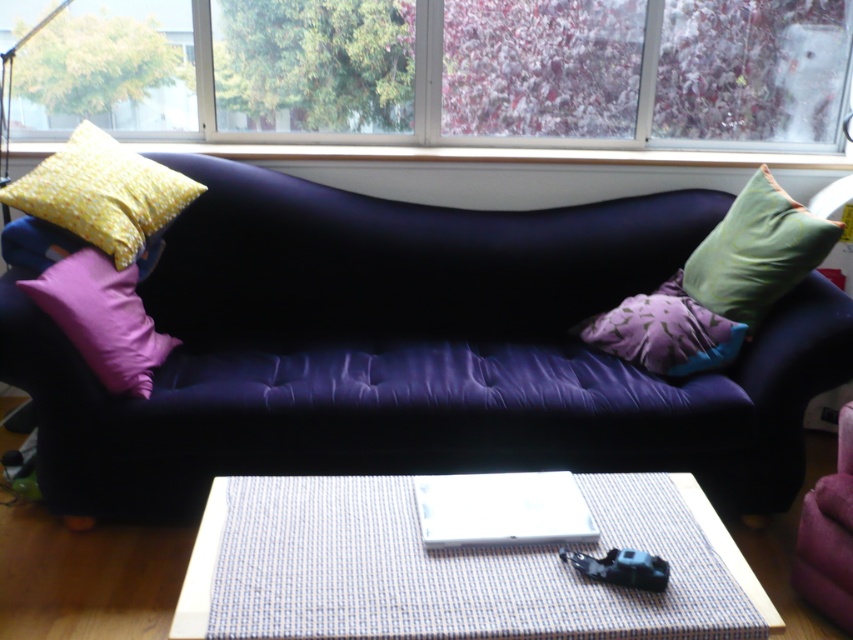
Question: Where is suede-like dark blue couch at center located in relation to white plastic pad at center in the image?

Choices:
 (A) below
 (B) above

Answer: (B)

Question: Which point is closer to the camera?

Choices:
 (A) coord(759,444)
 (B) coord(668,307)

Answer: (A)

Question: Estimate the real-world distances between objects in this image. Which object is closer to the purple fabric couch at lower right?

Choices:
 (A) green fabric pillow at right
 (B) suede-like dark blue couch at center

Answer: (A)

Question: Which of these objects is positioned farthest from the suede-like dark blue couch at center?

Choices:
 (A) yellow printed fabric pillow at left
 (B) purple fabric couch at lower right
 (C) green fabric pillow at right
 (D) purple fabric pillow at left

Answer: (B)

Question: Is transparent glass window at upper center to the right of purple fabric pillow at left from the viewer's perspective?

Choices:
 (A) no
 (B) yes

Answer: (B)

Question: Is yellow printed fabric pillow at left thinner than white plastic pad at center?

Choices:
 (A) yes
 (B) no

Answer: (B)